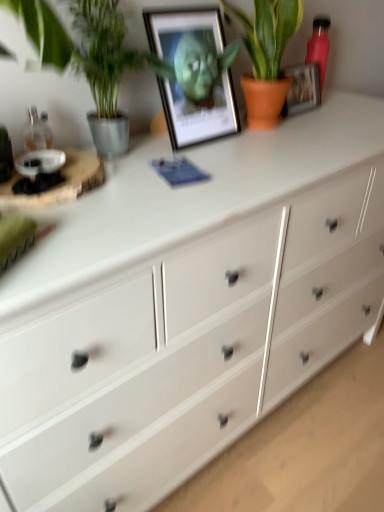
Question: Is metallic framed picture at upper center not within green leafy plant at left, which is counted as the first houseplant, starting from the left?

Choices:
 (A) yes
 (B) no

Answer: (A)

Question: From the image's perspective, is metallic framed picture at upper center located above green leafy plant at left, which is the second houseplant in right-to-left order?

Choices:
 (A) yes
 (B) no

Answer: (A)

Question: Does metallic framed picture at upper center have a greater width compared to green leafy plant at left, which is the second houseplant in right-to-left order?

Choices:
 (A) yes
 (B) no

Answer: (B)

Question: Is metallic framed picture at upper center facing towards green leafy plant at left, which is the second houseplant in right-to-left order?

Choices:
 (A) yes
 (B) no

Answer: (B)

Question: Can you confirm if metallic framed picture at upper center is positioned to the right of green leafy plant at left, which is the second houseplant in right-to-left order?

Choices:
 (A) yes
 (B) no

Answer: (A)

Question: Is green leafy plant at left, which is the second houseplant in right-to-left order, situated inside pink matte bottle at upper right or outside?

Choices:
 (A) outside
 (B) inside

Answer: (A)

Question: Considering the positions of point (44, 25) and point (322, 25), is point (44, 25) closer or farther from the camera than point (322, 25)?

Choices:
 (A) farther
 (B) closer

Answer: (B)

Question: Visually, is green leafy plant at left, which is the second houseplant in right-to-left order, positioned to the left or to the right of pink matte bottle at upper right?

Choices:
 (A) right
 (B) left

Answer: (B)

Question: In terms of size, does green leafy plant at left, which is the second houseplant in right-to-left order, appear bigger or smaller than pink matte bottle at upper right?

Choices:
 (A) small
 (B) big

Answer: (B)

Question: Based on their sizes in the image, would you say terracotta pot plant at upper center, the 2th houseplant when ordered from left to right, is bigger or smaller than green leafy plant at left, which is the second houseplant in right-to-left order?

Choices:
 (A) big
 (B) small

Answer: (A)

Question: From the image's perspective, is terracotta pot plant at upper center, which is counted as the 1th houseplant, starting from the right, located above or below green leafy plant at left, which is counted as the first houseplant, starting from the left?

Choices:
 (A) below
 (B) above

Answer: (B)

Question: Considering the positions of terracotta pot plant at upper center, the 2th houseplant when ordered from left to right, and green leafy plant at left, which is the second houseplant in right-to-left order, in the image, is terracotta pot plant at upper center, the 2th houseplant when ordered from left to right, taller or shorter than green leafy plant at left, which is the second houseplant in right-to-left order,?

Choices:
 (A) tall
 (B) short

Answer: (B)

Question: Considering the positions of terracotta pot plant at upper center, which is counted as the 1th houseplant, starting from the right, and green leafy plant at left, which is counted as the first houseplant, starting from the left, in the image, is terracotta pot plant at upper center, which is counted as the 1th houseplant, starting from the right, wider or thinner than green leafy plant at left, which is counted as the first houseplant, starting from the left,?

Choices:
 (A) thin
 (B) wide

Answer: (B)

Question: Is metallic framed picture at upper center situated inside pink matte bottle at upper right or outside?

Choices:
 (A) inside
 (B) outside

Answer: (B)

Question: Is metallic framed picture at upper center bigger or smaller than pink matte bottle at upper right?

Choices:
 (A) big
 (B) small

Answer: (A)